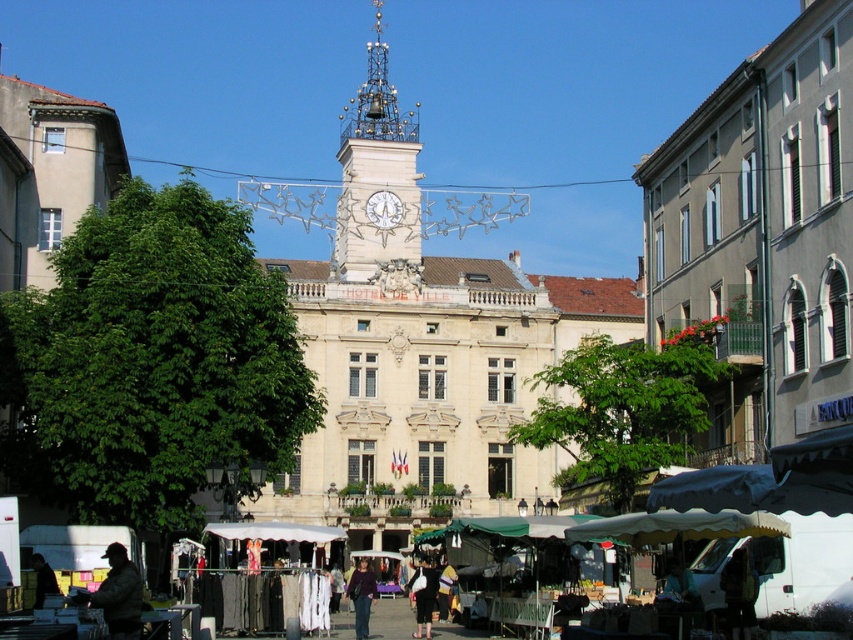
You are a customer at the outdoor market in front of Hotel de Ville. You want to buy the black fabric dress at center. Where should you look to find it?

The black fabric dress at center is located at the coordinates point (422, 596), so you should look there to find it.

You are standing in front of the Hotel de Ville, and you want to take a photo of the polished brass clock tower at center. You have a camera with a 50mm lens. Considering the clock tower is 108.84 meters away, will the clock tower appear larger or smaller in the photo compared to if you were using a 35mm lens?

The polished brass clock tower at center is 108.84 meters from the viewer. A 50mm lens has a narrower field of view than a 35mm lens, so the clock tower will appear slightly larger in the photo when using the 50mm lens compared to the 35mm lens.

Consider the image. You are standing in the bustling outdoor market in front of the Hotel de Ville. You see the polished brass clock tower at center and the dark purple sweater at center. Which object is positioned higher in the scene?

The polished brass clock tower at center is located above the dark purple sweater at center, so the clock tower is higher.